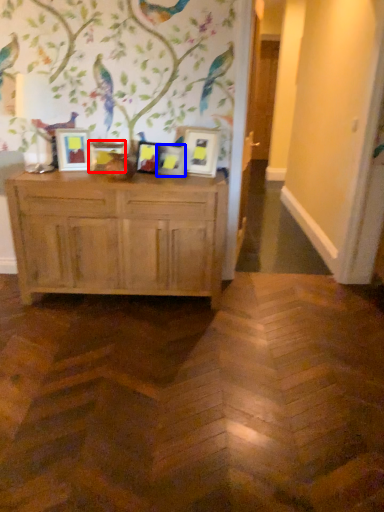
Question: Which object is further to the camera taking this photo, picture frame (highlighted by a red box) or picture frame (highlighted by a blue box)?

Choices:
 (A) picture frame
 (B) picture frame

Answer: (A)